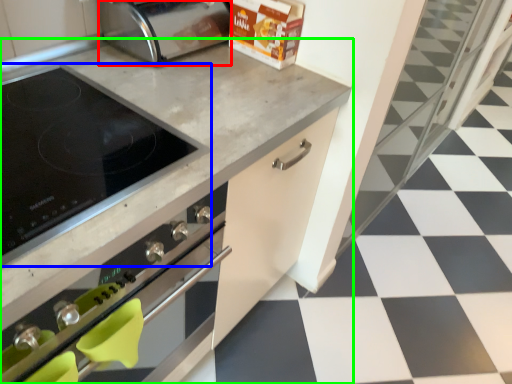
Question: Which object is positioned farthest from toaster (highlighted by a red box)? Select from kitchen appliance (highlighted by a blue box) and countertop (highlighted by a green box).

Choices:
 (A) kitchen appliance
 (B) countertop

Answer: (A)